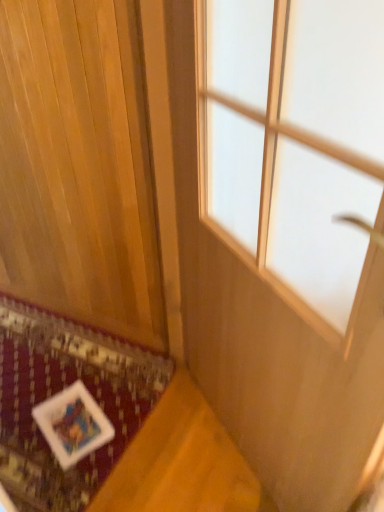
Question: Considering the positions of wooden panel at lower left and white fabric mat at lower left in the image, is wooden panel at lower left taller or shorter than white fabric mat at lower left?

Choices:
 (A) short
 (B) tall

Answer: (B)

Question: Is wooden panel at lower left to the left or to the right of white fabric mat at lower left in the image?

Choices:
 (A) left
 (B) right

Answer: (B)

Question: Estimate the real-world distances between objects in this image. Which object is closer to the transparent glass window at center?

Choices:
 (A) wooden panel at lower left
 (B) white fabric mat at lower left

Answer: (A)

Question: Which object is positioned closest to the wooden panel at lower left?

Choices:
 (A) transparent glass window at center
 (B) white fabric mat at lower left

Answer: (B)